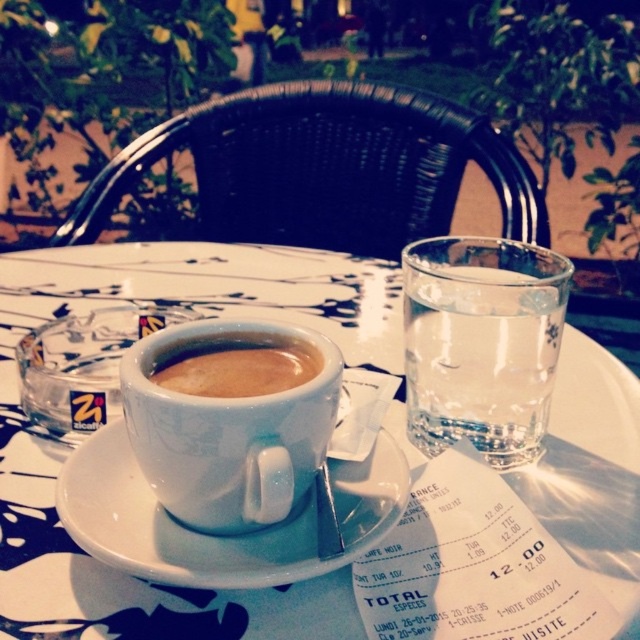
You are a customer at the cafe and want to place your phone on the table without it falling off. The phone is 6 inches long. The white ceramic saucer at center is in the way. Can you slide the phone past the saucer to the edge of the table?

The white ceramic saucer at center and viewer are 8.00 inches apart. Since the phone is 6 inches long, sliding it past the saucer would require at least 6 inches of space. However, the distance between the saucer and the viewer is 8 inches, which may not directly indicate the space needed. Without knowing the table edge distance, it is uncertain if there is enough space.